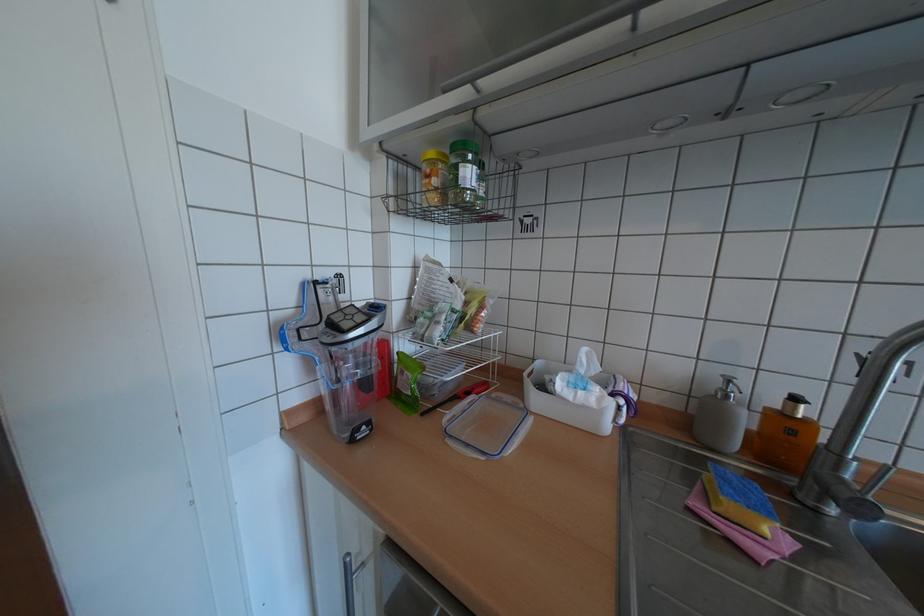
Which object does [487,426] point to?

It corresponds to the plastic container lid in the image.